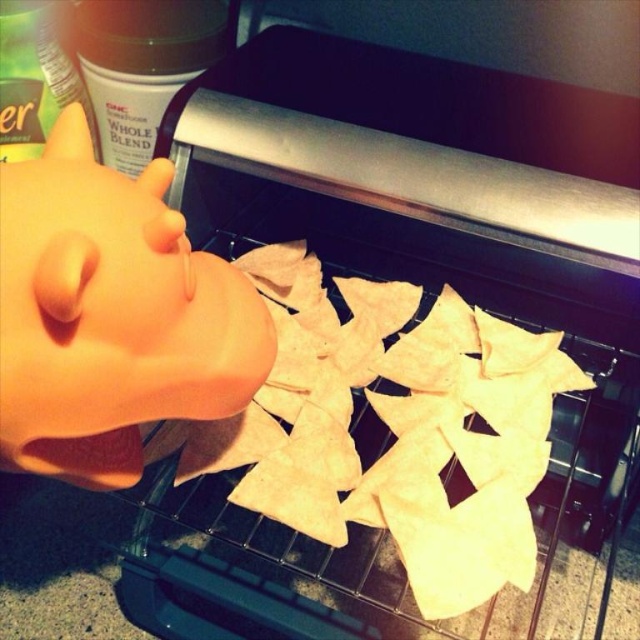
You are holding a 17 inch long spatula and want to reach the light brown tortilla chips at center in the toaster oven. Can you safely retrieve them without burning your hand?

The light brown tortilla chips at center are 16.85 inches from the viewer. Since the spatula is 17 inches long, it can reach them, but there might be a slight risk of the spatula touching the toaster oven walls or the chips not being centered enough. However, the length is sufficient to potentially reach them safely.

You are a chef preparing to place a new batch of tortilla chips into the toaster oven. You have a new batch of chips that are exactly the same size as the matte plastic head at left. Where should you place them to ensure they fit comfortably without overlapping the existing light brown tortilla chips at center?

Since the light brown tortilla chips at center are larger in size than the matte plastic head at left, the new chips, which are the same size as the matte plastic head at left, will fit comfortably in the toaster oven without overlapping if placed near the edges or in gaps between the larger existing chips.

From the picture: You are standing in front of the toaster oven and want to place a new tortilla chip somewhere between the two points, point (406, 467) and point (84, 218). Which point should you place it closer to so that it stays in front of the other point?

To keep the new tortilla chip in front of both points, place it closer to point (84, 218) because it is in front of point (406, 467).